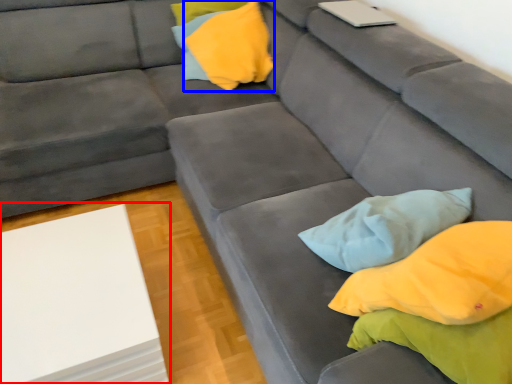
Question: Which of the following is the closest to the observer, table (highlighted by a red box) or pillow (highlighted by a blue box)?

Choices:
 (A) table
 (B) pillow

Answer: (A)